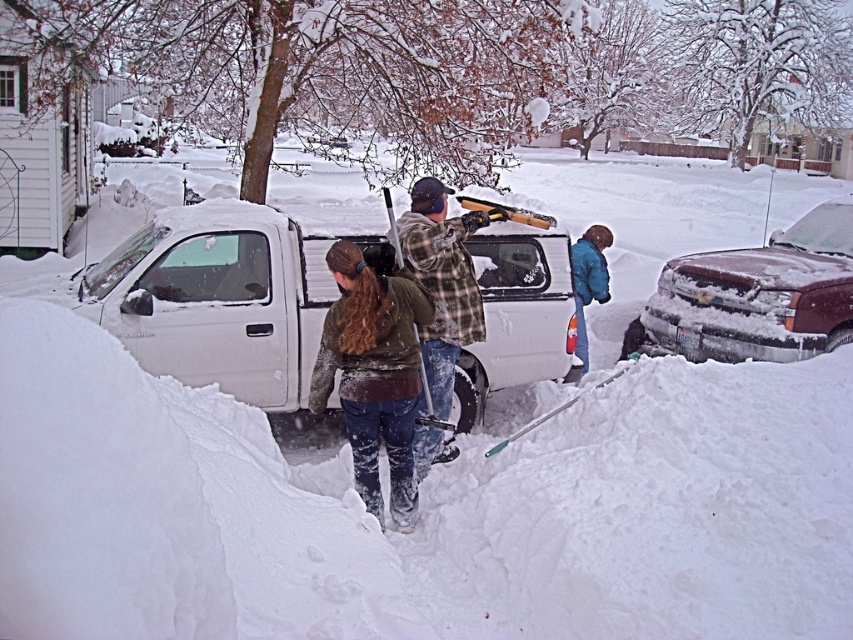
Question: Is shiny brown car at lower right above green fuzzy sweater at center?

Choices:
 (A) yes
 (B) no

Answer: (A)

Question: Can you confirm if white matte truck at center is positioned below green fuzzy sweater at center?

Choices:
 (A) yes
 (B) no

Answer: (B)

Question: Which object is closer to the camera taking this photo?

Choices:
 (A) shiny brown car at lower right
 (B) green fuzzy sweater at center
 (C) white matte truck at center

Answer: (B)

Question: Does white matte truck at center appear over flannel plaid shirt at center?

Choices:
 (A) yes
 (B) no

Answer: (A)

Question: Among these objects, which one is farthest from the camera?

Choices:
 (A) white matte truck at center
 (B) green fuzzy sweater at center
 (C) flannel plaid shirt at center

Answer: (A)

Question: Among these points, which one is farthest from the camera?

Choices:
 (A) (450, 353)
 (B) (404, 282)

Answer: (A)